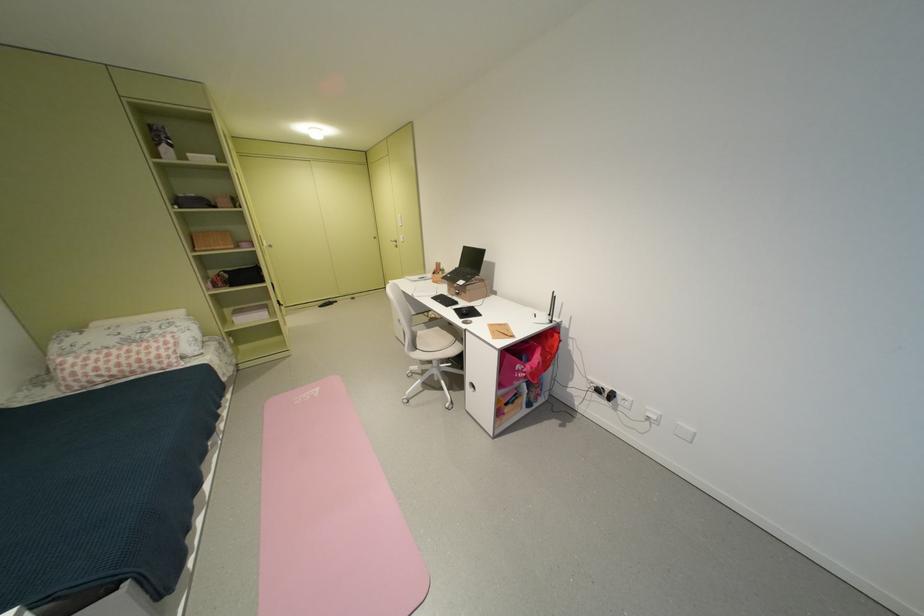
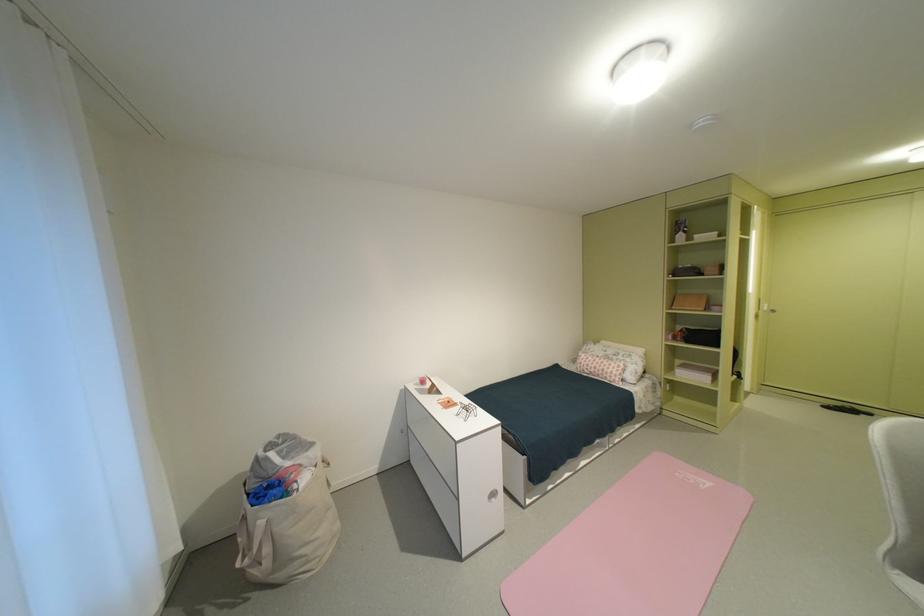
Question: The camera is either moving clockwise (left) or counter-clockwise (right) around the object. The first image is from the beginning of the video and the second image is from the end. Is the camera moving left or right when shooting the video?

Choices:
 (A) Left
 (B) Right

Answer: (B)